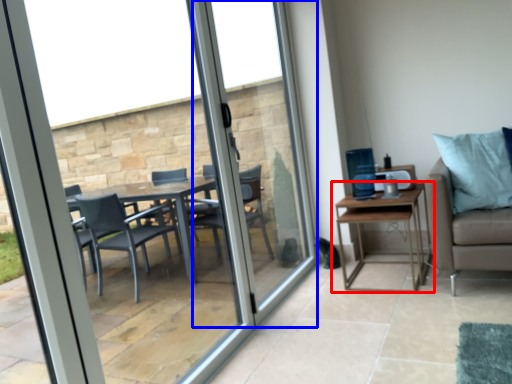
Question: Which of the following is the closest to the observer, table (highlighted by a red box) or screen door (highlighted by a blue box)?

Choices:
 (A) table
 (B) screen door

Answer: (B)